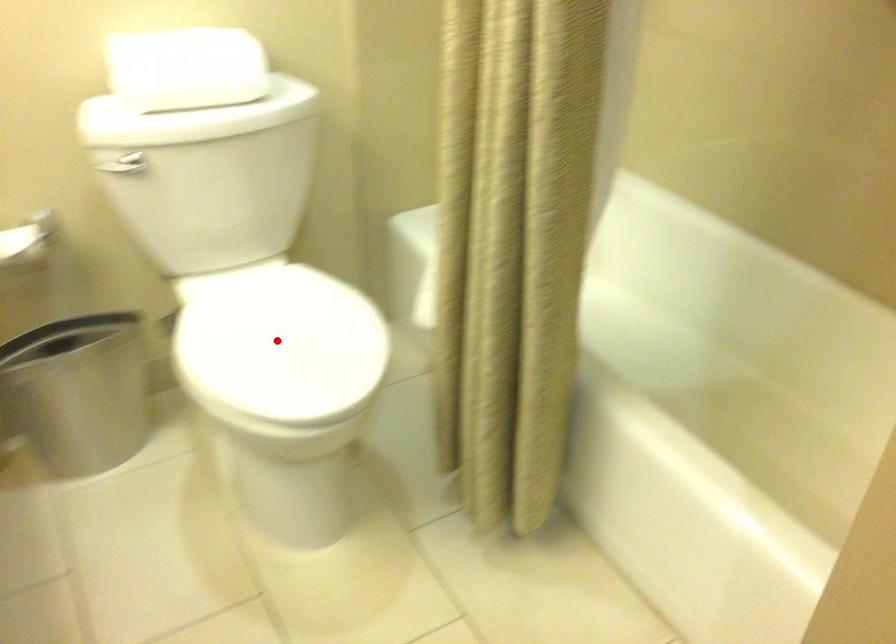
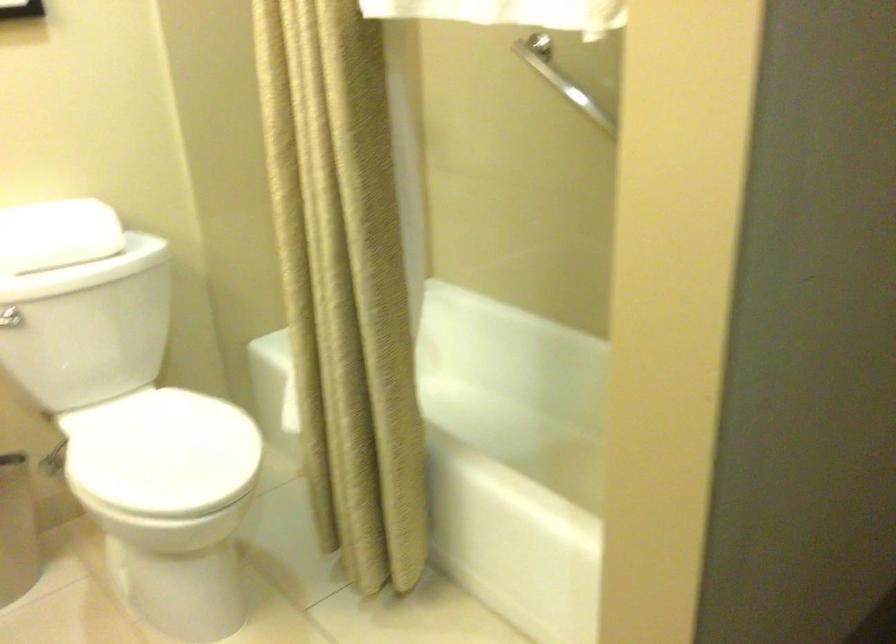
Question: A red point is marked in image1. In image2, is the corresponding 3D point closer to the camera or farther? Reply with the corresponding letter.

Choices:
 (A) The corresponding 3D point is closer.
 (B) The corresponding 3D point is farther.

Answer: (B)